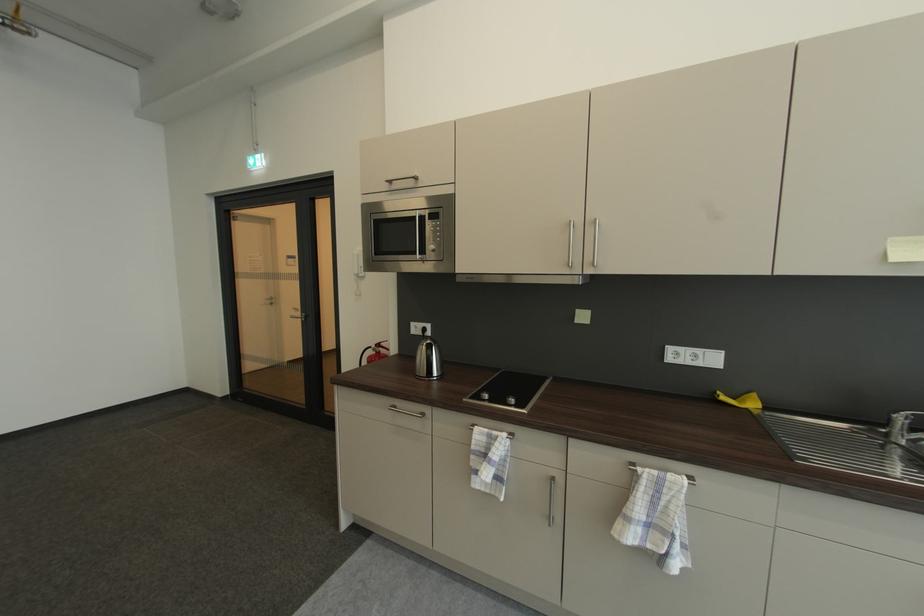
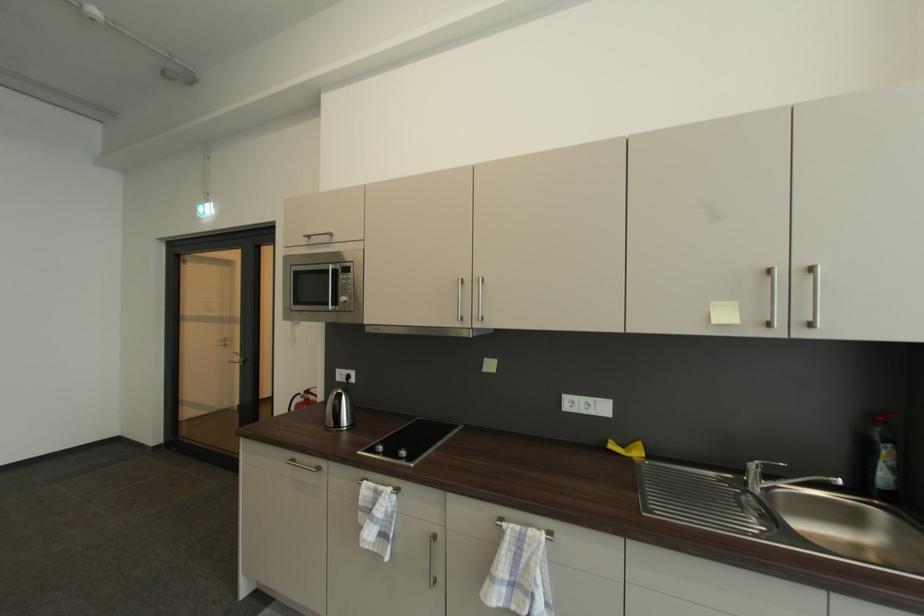
Where in the second image is the point corresponding to [395,411] from the first image?

(295, 464)